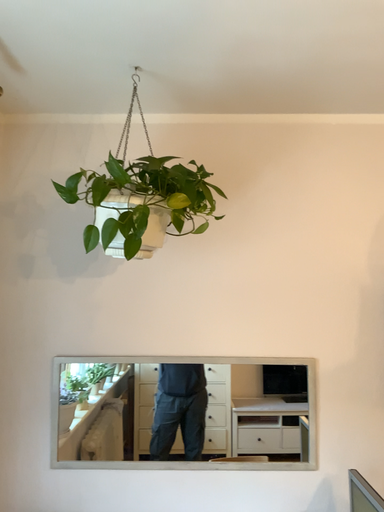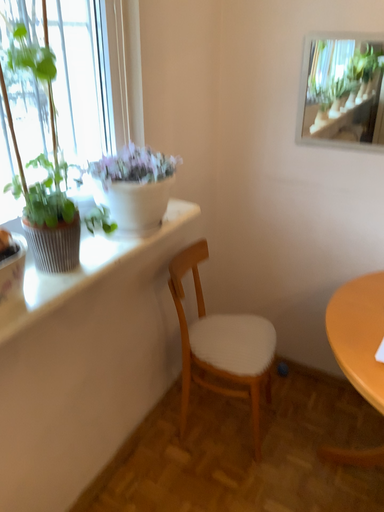
Question: How did the camera likely rotate when shooting the video?

Choices:
 (A) rotated upward
 (B) rotated downward

Answer: (B)